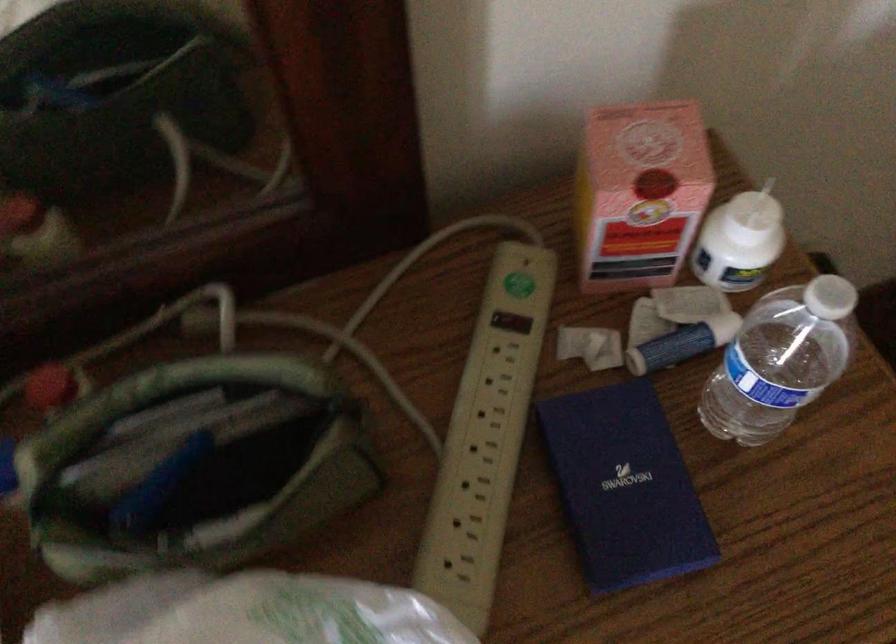
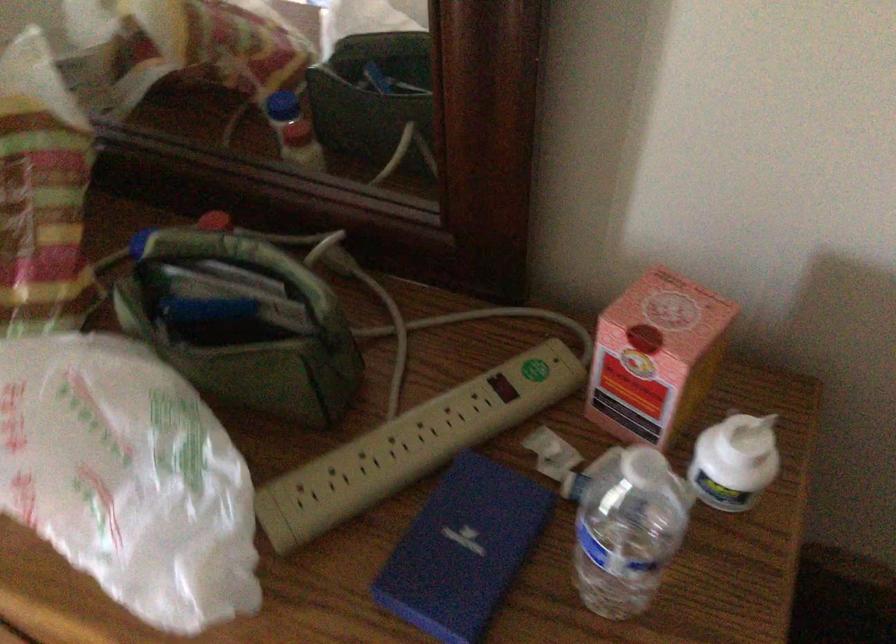
In the second image, find the point that corresponds to the point at 676,200 in the first image.

(656, 357)